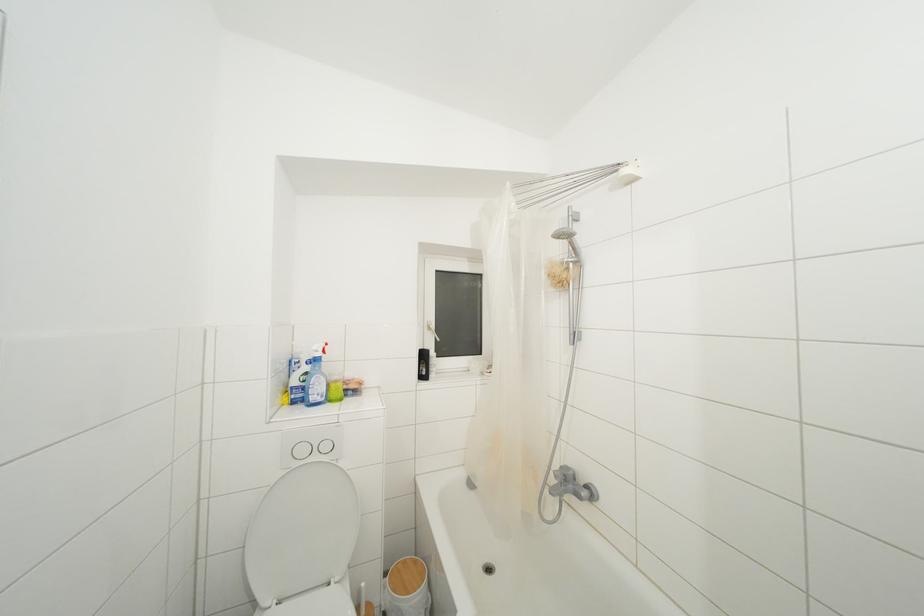
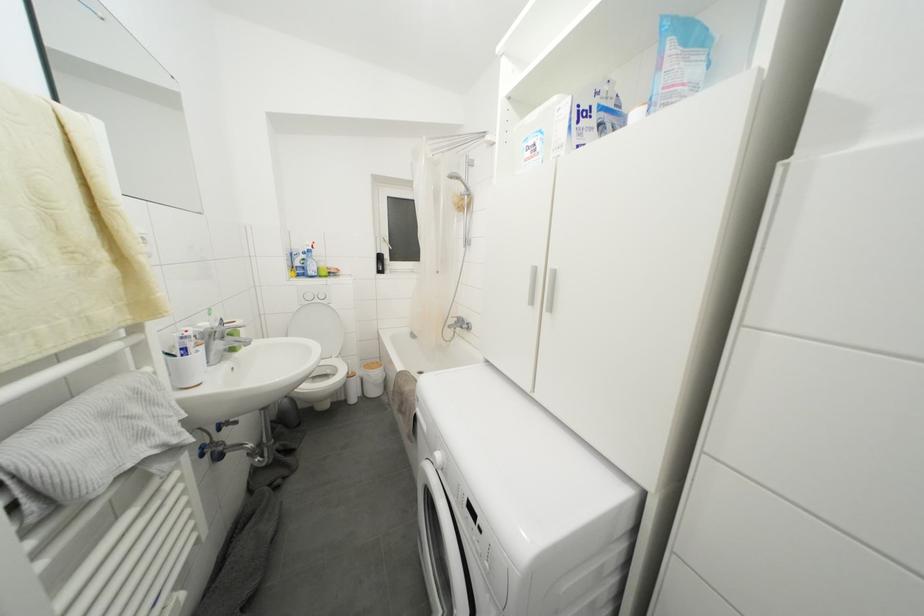
Where in the second image is the point corresponding to point 310,379 from the first image?

(308, 264)